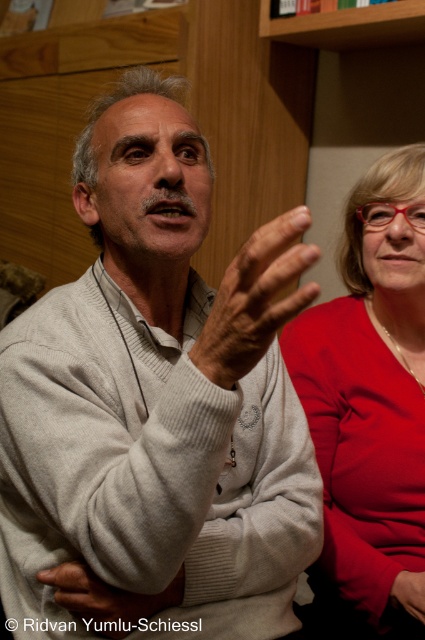
You are standing in the room and need to locate the gray woolen sweater at center. According to the coordinates provided, where exactly should you look?

The gray woolen sweater at center is located at point 0.467 along the horizontal axis and 0.600 along the vertical axis.

You are a tailor measuring the distance between two garments for a display. The matte red blouse at right and the gray woolen sweater at center are part of a collection. Can you fit both items on a 60 cm wide display shelf without overlapping?

The matte red blouse at right and gray woolen sweater at center are 60.61 centimeters apart from each other. Since the display shelf is only 60 cm wide, the items cannot fit without overlapping as the distance between them exceeds the shelf width.

You are organizing a charity event and need to arrange two donated items based on their height. You have a light gray knitted sweater at center and a matte red blouse at right. Which item should you place on the lower shelf if the shelves are arranged from shortest to tallest?

The light gray knitted sweater at center has a lesser height compared to the matte red blouse at right, so it should be placed on the lower shelf.